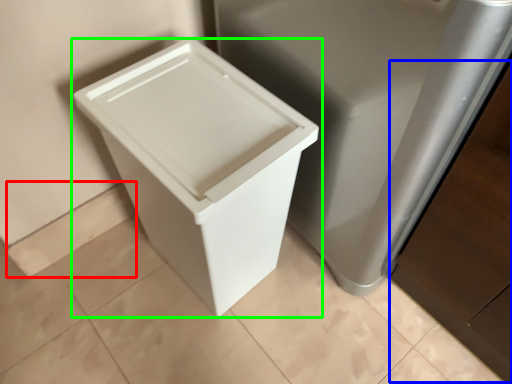
Question: Which is farther away from square (highlighted by a red box)? cabinetry (highlighted by a blue box) or waste container (highlighted by a green box)?

Choices:
 (A) cabinetry
 (B) waste container

Answer: (A)